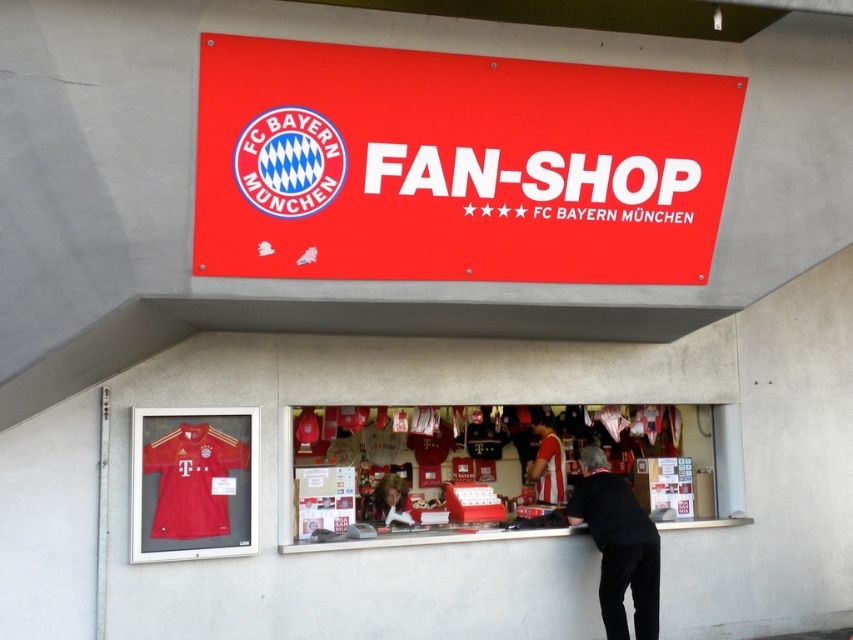
Question: Is matte jersey at center to the left of matte red jersey at center from the viewer's perspective?

Choices:
 (A) no
 (B) yes

Answer: (B)

Question: Can you confirm if matte jersey at center is wider than matte red jersey at center?

Choices:
 (A) no
 (B) yes

Answer: (A)

Question: Which of these objects is positioned farthest from the black fabric at lower right?

Choices:
 (A) matte jersey at center
 (B) red matte sign at upper center
 (C) smooth white shirt at center

Answer: (A)

Question: Is matte jersey at center to the left of smooth white shirt at center from the viewer's perspective?

Choices:
 (A) no
 (B) yes

Answer: (B)

Question: Among these points, which one is farthest from the camera?

Choices:
 (A) (318, 253)
 (B) (167, 493)

Answer: (B)

Question: Which point appears closest to the camera in this image?

Choices:
 (A) (512, 240)
 (B) (630, 552)
 (C) (560, 476)

Answer: (A)